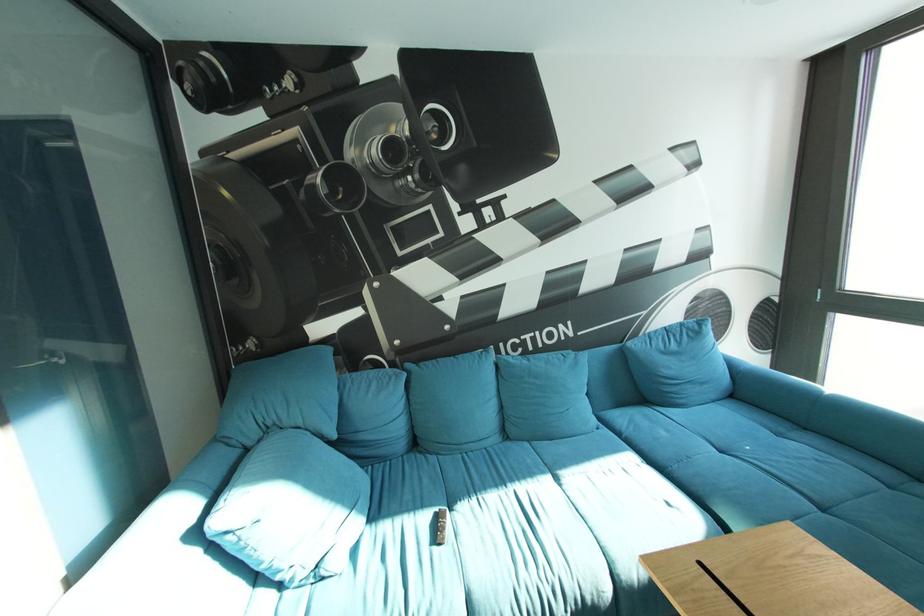
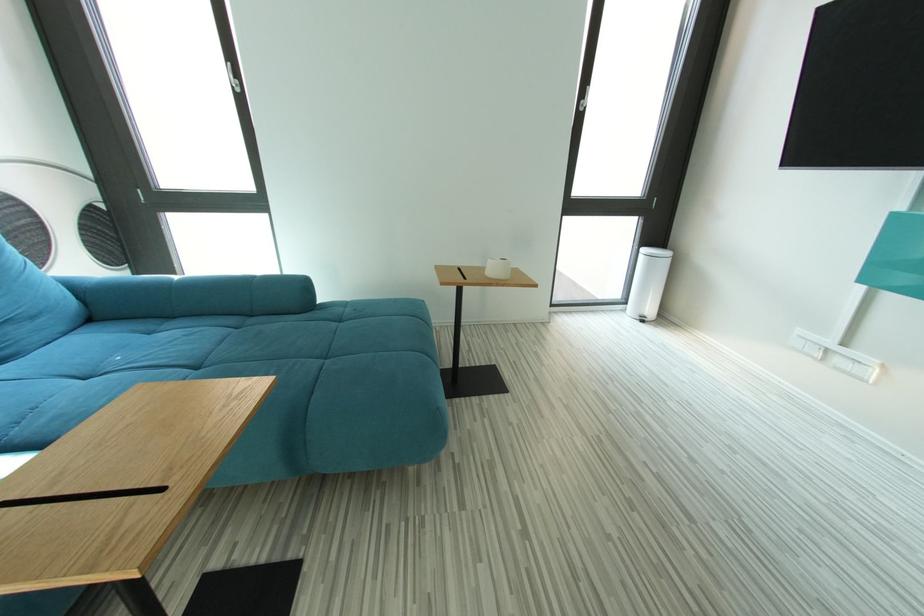
How did the camera likely rotate?

The camera rotated toward right-down.